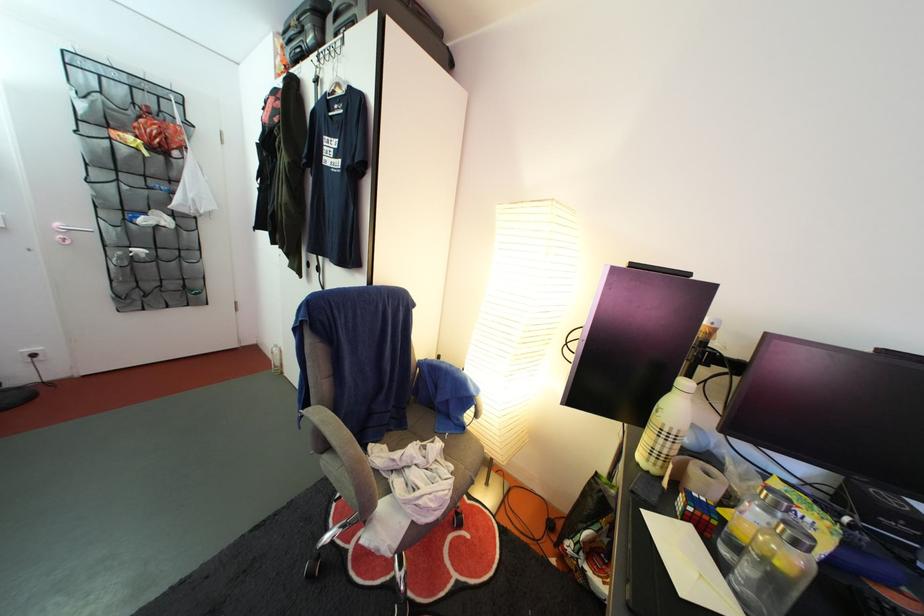
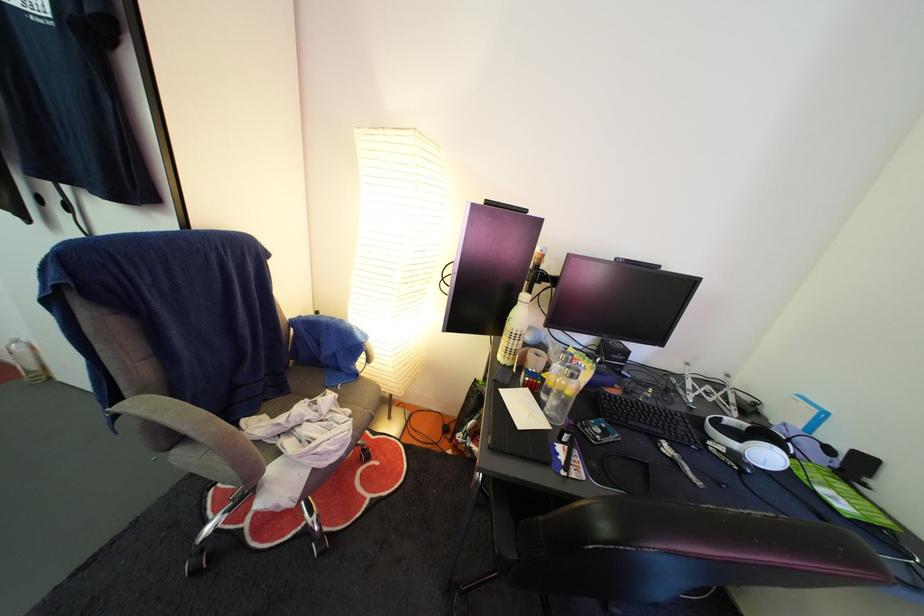
The point at (641, 501) is marked in the first image. Where is the corresponding point in the second image?

(504, 389)